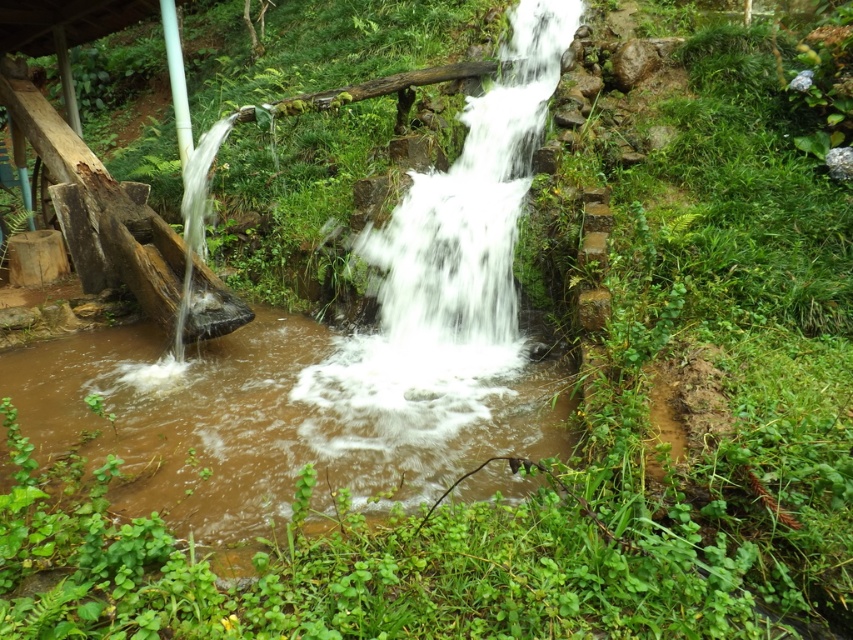
Question: Can you confirm if brown muddy water at center is bigger than white frothy water at center?

Choices:
 (A) yes
 (B) no

Answer: (A)

Question: Where is brown muddy water at center located in relation to white frothy water at center in the image?

Choices:
 (A) right
 (B) left

Answer: (B)

Question: Is brown muddy water at center bigger than white frothy water at center?

Choices:
 (A) no
 (B) yes

Answer: (B)

Question: Which point appears closest to the camera in this image?

Choices:
 (A) (252, 456)
 (B) (451, 372)

Answer: (A)

Question: Which object appears closest to the camera in this image?

Choices:
 (A) white frothy water at center
 (B) brown muddy water at center

Answer: (B)